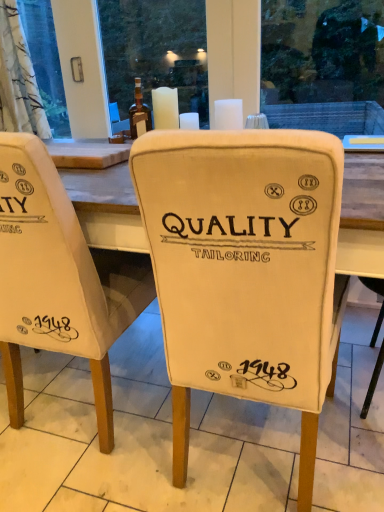
The image size is (384, 512). Find the location of `vacant region below white fabric chair at center, which appears as the 2th chair when viewed from the right (from a real-world perspective)`. vacant region below white fabric chair at center, which appears as the 2th chair when viewed from the right (from a real-world perspective) is located at coordinates point(89,402).